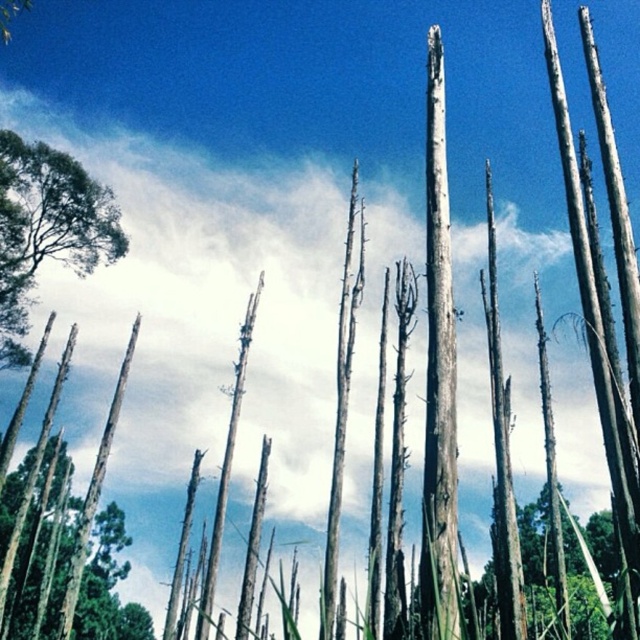
In the scene shown: You are standing in a forest and see the gray rough bark tree trunk at center and the green leafy tree at left. Which tree is closer to you?

The gray rough bark tree trunk at center is closer to you because it is positioned in front of the green leafy tree at left.

Looking at the image, which tree is positioned to the right of the other between the gray rough bark tree trunk at center and the green leafy tree at left?

The gray rough bark tree trunk at center is positioned to the right of the green leafy tree at left.